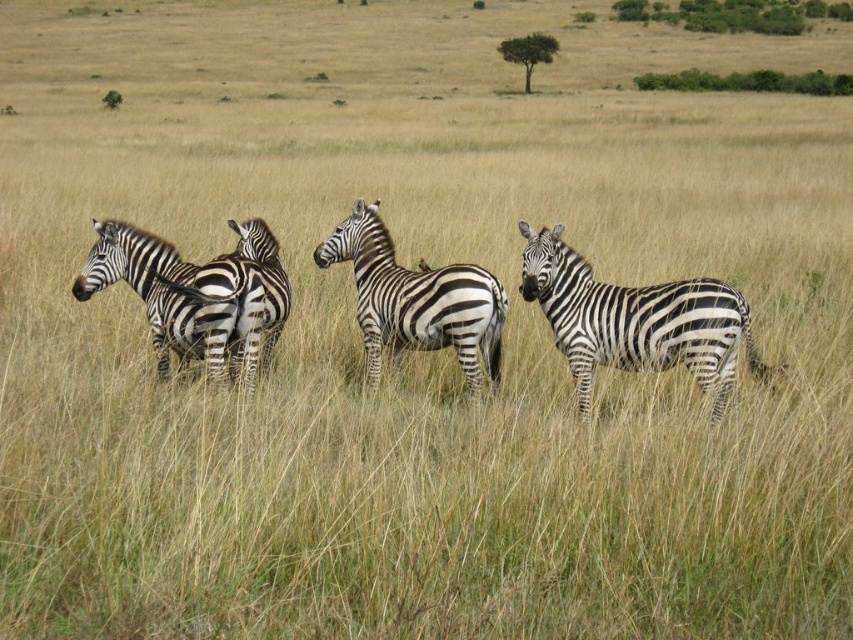
Question: Can you confirm if black and white striped zebra at left is thinner than black and white striped zebra at center?

Choices:
 (A) yes
 (B) no

Answer: (B)

Question: Which point appears closest to the camera in this image?

Choices:
 (A) (621, 301)
 (B) (461, 365)
 (C) (177, 280)
 (D) (755, 352)

Answer: (A)

Question: Can you confirm if black and white striped zebras at left is positioned to the right of black and white striped zebra at left?

Choices:
 (A) no
 (B) yes

Answer: (A)

Question: Among these points, which one is farthest from the camera?

Choices:
 (A) (409, 269)
 (B) (399, 339)

Answer: (A)

Question: Which point is closer to the camera taking this photo?

Choices:
 (A) (83, 269)
 (B) (573, 353)

Answer: (B)

Question: Does black and white striped zebras at left have a lesser width compared to black and white striped zebra at center?

Choices:
 (A) no
 (B) yes

Answer: (A)